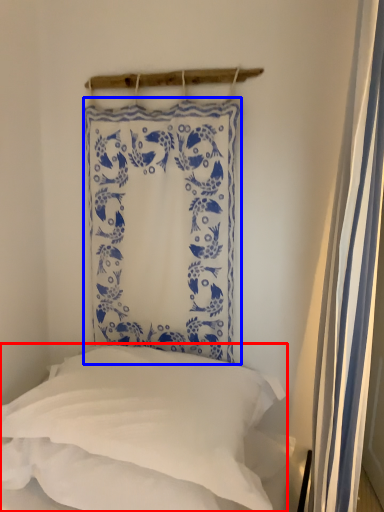
Question: Which of the following is the closest to the observer, pillow (highlighted by a red box) or curtain (highlighted by a blue box)?

Choices:
 (A) pillow
 (B) curtain

Answer: (A)